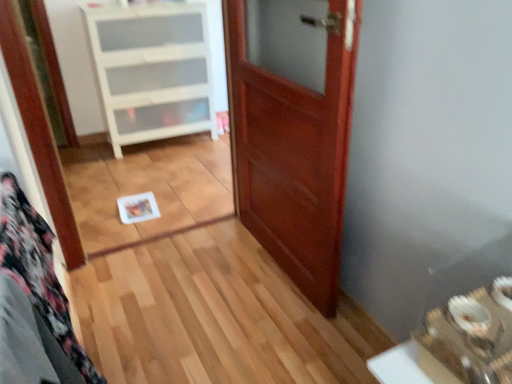
Where is `free space to the left of mahogany wood door at center`? free space to the left of mahogany wood door at center is located at coordinates (193, 275).